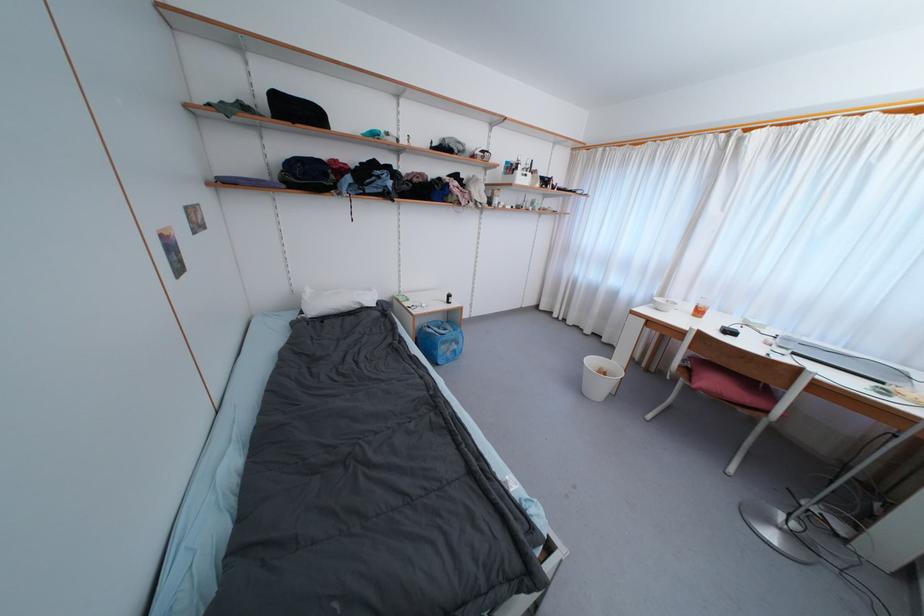
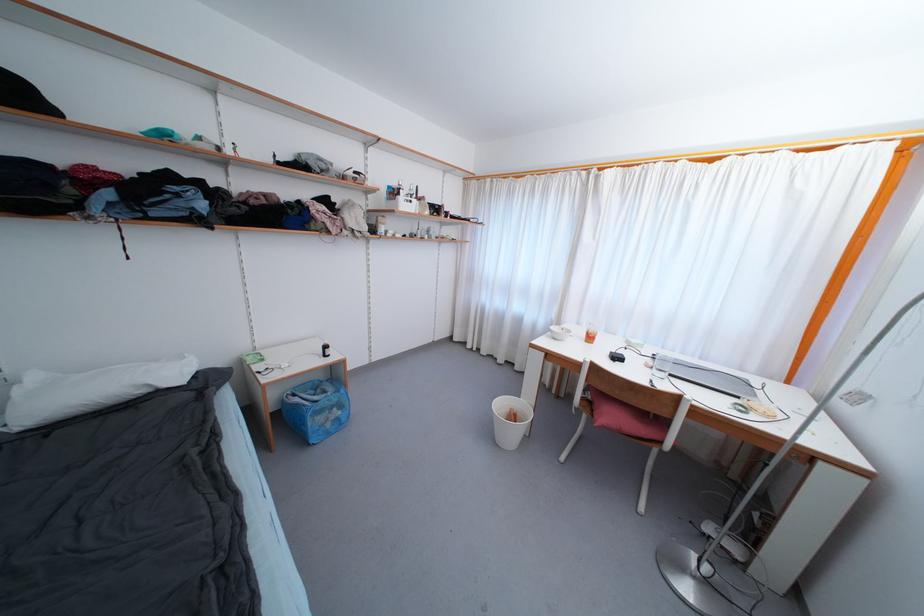
Question: I am providing you with two images of the same scene from different viewpoints. After the viewpoint changes to image2, which objects are now occluded?

Choices:
 (A) orange plastic cup
 (B) black computer mouse
 (C) white trash can
 (D) none of these

Answer: (D)